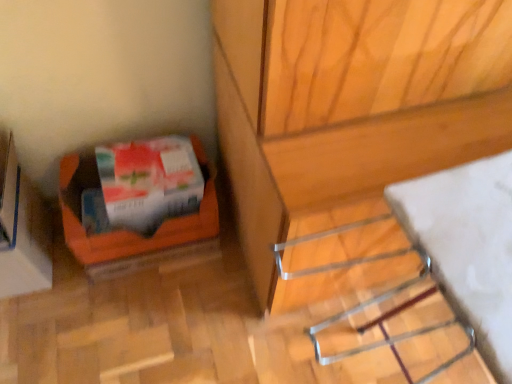
Identify the location of free space in front of orange cardboard box at lower left. The height and width of the screenshot is (384, 512). (39, 331).